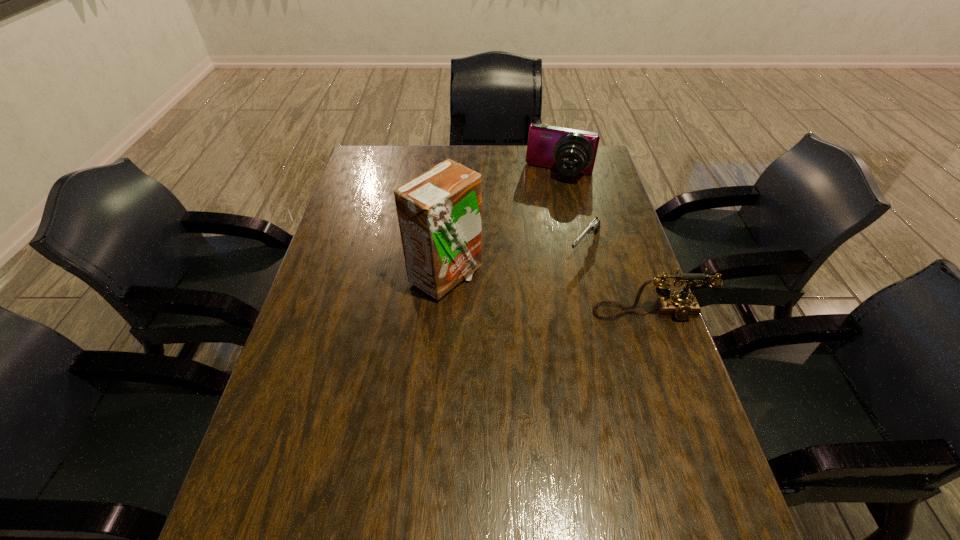
Locate an element on the screen. vacant space on the desktop that is between the tallest object and the telephone and is positioned on the front-facing side of the camera is located at coordinates (518, 289).

Where is `vacant spot on the desktop that is between the carton and the telephone and is positioned on the front-facing side of the pistol`? vacant spot on the desktop that is between the carton and the telephone and is positioned on the front-facing side of the pistol is located at coordinates (543, 294).

Image resolution: width=960 pixels, height=540 pixels. What are the coordinates of `free space on the desktop that is between the carton and the telephone and is positioned at the narrow end of the pinecone` in the screenshot? It's located at (539, 293).